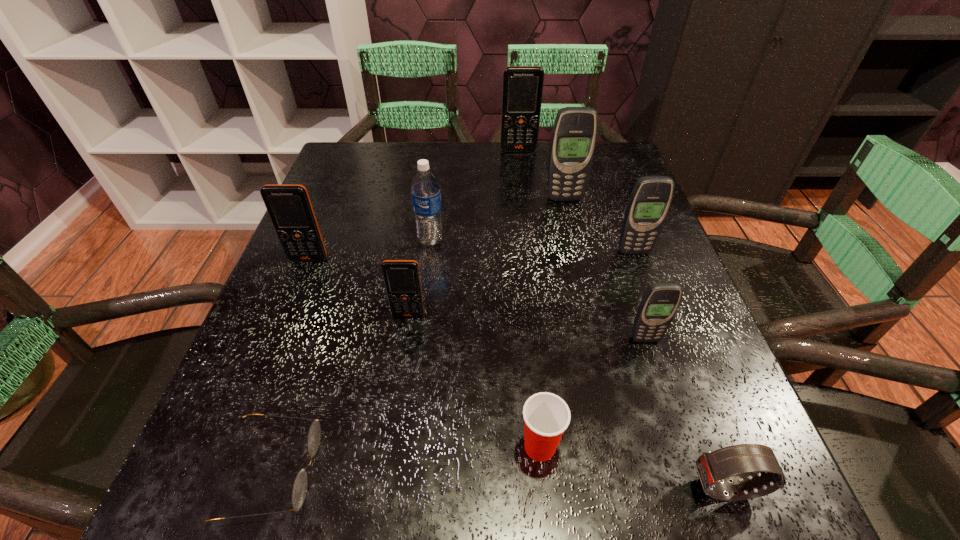
Point out which gray cellular telephone is positioned as the second nearest to the second nearest gray cellular telephone. Please provide its 2D coordinates. Your answer should be formatted as a tuple, i.e. [(x, y)], where the tuple contains the x and y coordinates of a point satisfying the conditions above.

[(660, 302)]